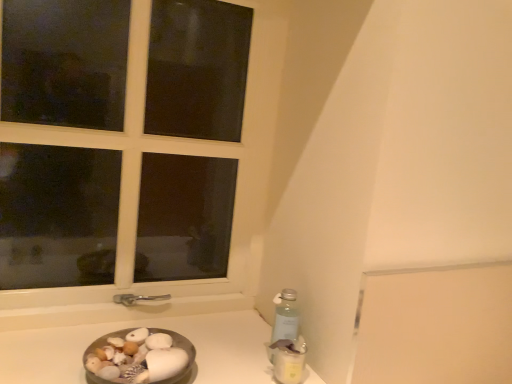
This screenshot has height=384, width=512. What are the coordinates of `free space above smooth white shells at lower left (from a real-world perspective)` in the screenshot? It's located at (157, 362).